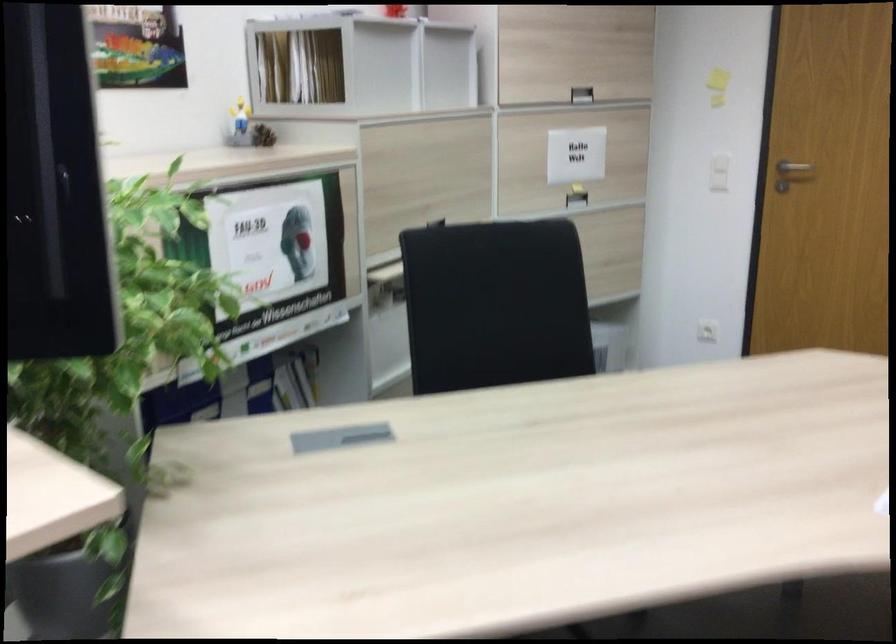
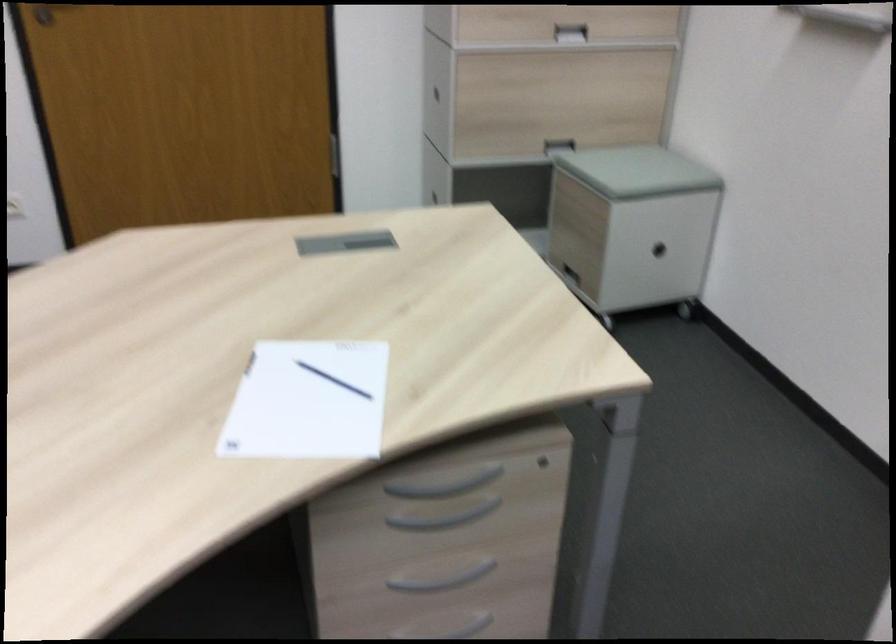
The images are taken continuously from a first-person perspective. In which direction is your viewpoint rotating?

The rotation direction of the camera is right-down.